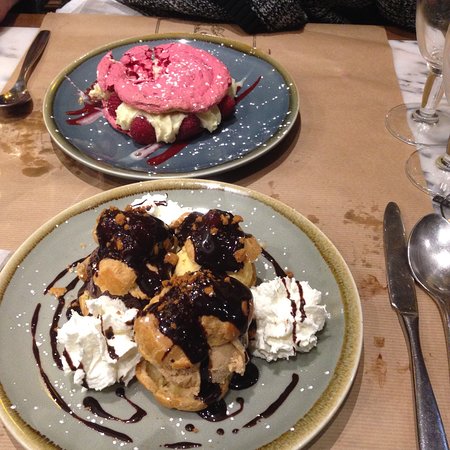
At what (x,y) coordinates should I click in order to perform the action: click on butter knife. Please return your answer as a coordinate pair (x, y). Looking at the image, I should click on (405, 307).